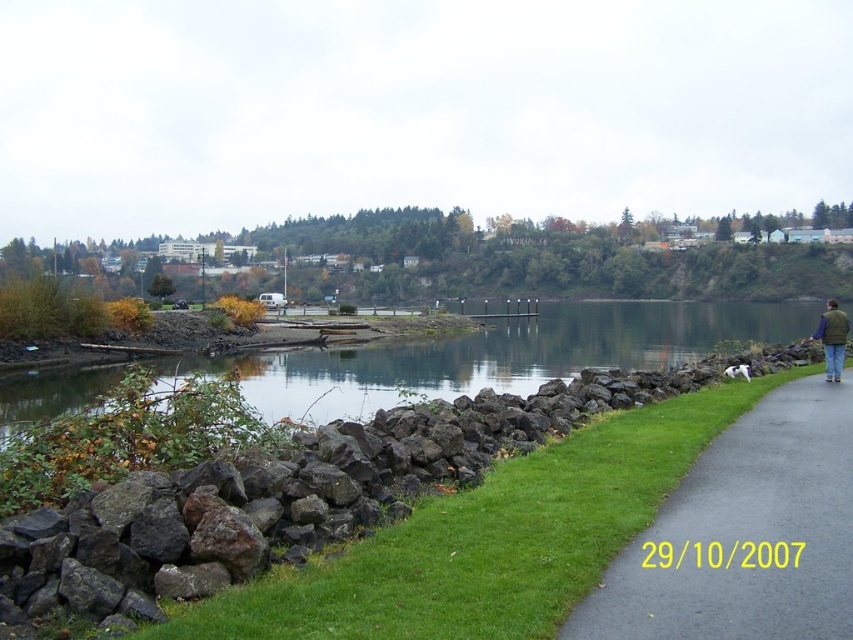
Question: Which object is positioned closest to the green grass at lower left?

Choices:
 (A) green vest at lower right
 (B) black asphalt pavement at lower right
 (C) clear water at center

Answer: (B)

Question: Considering the relative positions of black asphalt pavement at lower right and green vest at lower right in the image provided, where is black asphalt pavement at lower right located with respect to green vest at lower right?

Choices:
 (A) left
 (B) right

Answer: (A)

Question: Which object is positioned farthest from the green grass at lower left?

Choices:
 (A) green vest at lower right
 (B) black asphalt pavement at lower right
 (C) clear water at center

Answer: (C)

Question: Can you confirm if black asphalt pavement at lower right is bigger than green vest at lower right?

Choices:
 (A) yes
 (B) no

Answer: (B)

Question: Which point is closer to the camera?

Choices:
 (A) (322, 572)
 (B) (419, 385)

Answer: (A)

Question: From the image, what is the correct spatial relationship of clear water at center in relation to green vest at lower right?

Choices:
 (A) right
 (B) left

Answer: (B)